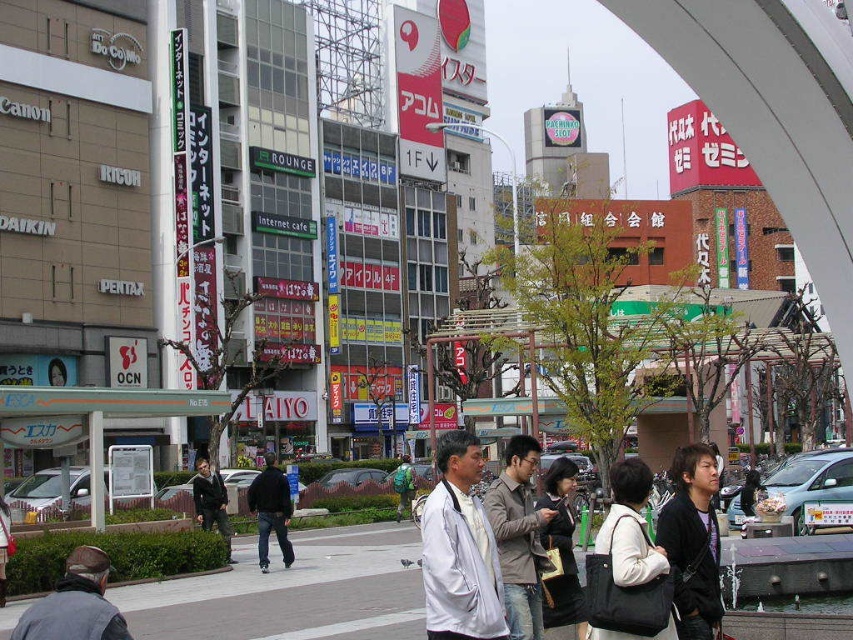
You are a photographer standing at the pedestrian crossing in the city scene. You notice a dark brown leather jacket at center and a green backpack at center. Which object is taller?

The dark brown leather jacket at center is much taller than the green backpack at center.